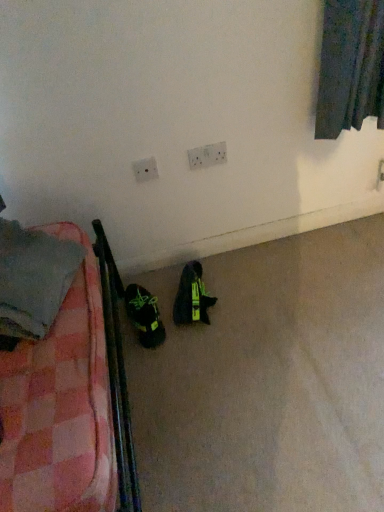
What is the approximate width of white plastic electric outlet at upper center, the 1th electric outlet in the left-to-right sequence?

white plastic electric outlet at upper center, the 1th electric outlet in the left-to-right sequence, is 1.00 centimeters wide.

What do you see at coordinates (207, 156) in the screenshot?
I see `white plastic electric outlet at upper center, the 2th electric outlet in the left-to-right sequence` at bounding box center [207, 156].

How much space does green matte sneakers at lower left, positioned as the first footwear in left-to-right order, occupy horizontally?

The width of green matte sneakers at lower left, positioned as the first footwear in left-to-right order, is 9.96 inches.

Describe the element at coordinates (33, 278) in the screenshot. I see `plaid fabric blanket at left` at that location.

I want to click on green synthetic shoe at center, which ranks as the first footwear in right-to-left order, so click(192, 297).

Can we say white plastic electric outlet at upper center, which is the second electric outlet in right-to-left order, lies outside plaid fabric blanket at left?

white plastic electric outlet at upper center, which is the second electric outlet in right-to-left order, lies outside plaid fabric blanket at left's area.

Which is behind, white plastic electric outlet at upper center, which is the second electric outlet in right-to-left order, or plaid fabric blanket at left?

white plastic electric outlet at upper center, which is the second electric outlet in right-to-left order.

Based on their sizes in the image, would you say white plastic electric outlet at upper center, which is the second electric outlet in right-to-left order, is bigger or smaller than plaid fabric blanket at left?

Considering their sizes, white plastic electric outlet at upper center, which is the second electric outlet in right-to-left order, takes up less space than plaid fabric blanket at left.

Does white plastic electric outlet at upper center, the 1th electric outlet in the left-to-right sequence, have a greater width compared to plaid fabric blanket at left?

No.

Can you confirm if plaid fabric blanket at left is positioned to the left of green matte sneakers at lower left, positioned as the first footwear in left-to-right order?

Yes, plaid fabric blanket at left is to the left of green matte sneakers at lower left, positioned as the first footwear in left-to-right order.

From the image's perspective, is plaid fabric blanket at left above or below green matte sneakers at lower left, arranged as the 2th footwear when viewed from the right?

plaid fabric blanket at left is above green matte sneakers at lower left, arranged as the 2th footwear when viewed from the right.

In the image, is plaid fabric blanket at left positioned in front of or behind green matte sneakers at lower left, arranged as the 2th footwear when viewed from the right?

Clearly, plaid fabric blanket at left is in front of green matte sneakers at lower left, arranged as the 2th footwear when viewed from the right.

Is plaid fabric blanket at left oriented away from green matte sneakers at lower left, arranged as the 2th footwear when viewed from the right?

plaid fabric blanket at left does not have its back to green matte sneakers at lower left, arranged as the 2th footwear when viewed from the right.

At what (x,y) coordinates should I click in order to perform the action: click on footwear below the green synthetic shoe at center, which appears as the second footwear when viewed from the left (from the image's perspective). Please return your answer as a coordinate pair (x, y). This screenshot has height=512, width=384. Looking at the image, I should click on (144, 316).

Which object is closer to the camera taking this photo, green matte sneakers at lower left, arranged as the 2th footwear when viewed from the right, or green synthetic shoe at center, which appears as the second footwear when viewed from the left?

green matte sneakers at lower left, arranged as the 2th footwear when viewed from the right.

Between green matte sneakers at lower left, arranged as the 2th footwear when viewed from the right, and green synthetic shoe at center, which appears as the second footwear when viewed from the left, which one has more height?

green matte sneakers at lower left, arranged as the 2th footwear when viewed from the right.

In terms of width, does plaid fabric blanket at left look wider or thinner when compared to white plastic electric outlet at upper center, the 2th electric outlet in the left-to-right sequence?

plaid fabric blanket at left is wider than white plastic electric outlet at upper center, the 2th electric outlet in the left-to-right sequence.

Is white plastic electric outlet at upper center, the first electric outlet from the right, inside plaid fabric blanket at left?

No, white plastic electric outlet at upper center, the first electric outlet from the right, is not inside plaid fabric blanket at left.

Measure the distance from plaid fabric blanket at left to white plastic electric outlet at upper center, the 2th electric outlet in the left-to-right sequence.

plaid fabric blanket at left is 69.74 centimeters from white plastic electric outlet at upper center, the 2th electric outlet in the left-to-right sequence.

Find the location of a particular element. the 2nd electric outlet counting from the right side of the plaid fabric blanket at left is located at coordinates (207, 156).

Is white plastic electric outlet at upper center, the first electric outlet from the right, turned away from plaid fabric blanket at left?

white plastic electric outlet at upper center, the first electric outlet from the right, is not turned away from plaid fabric blanket at left.

Visually, is white plastic electric outlet at upper center, the first electric outlet from the right, positioned to the left or to the right of plaid fabric blanket at left?

white plastic electric outlet at upper center, the first electric outlet from the right, is positioned on plaid fabric blanket at left's right side.

From the image's perspective, is white plastic electric outlet at upper center, the first electric outlet from the right, above or below plaid fabric blanket at left?

white plastic electric outlet at upper center, the first electric outlet from the right, is situated higher than plaid fabric blanket at left in the image.

What's the angular difference between white plastic electric outlet at upper center, the first electric outlet from the right, and plaid fabric blanket at left's facing directions?

The angular difference between white plastic electric outlet at upper center, the first electric outlet from the right, and plaid fabric blanket at left is 66.2 degrees.

This screenshot has width=384, height=512. Find the location of `electric outlet that is the 1st one when counting rightward from the green matte sneakers at lower left, arranged as the 2th footwear when viewed from the right`. electric outlet that is the 1st one when counting rightward from the green matte sneakers at lower left, arranged as the 2th footwear when viewed from the right is located at coordinates (145, 170).

Is green matte sneakers at lower left, arranged as the 2th footwear when viewed from the right, oriented away from white plastic electric outlet at upper center, which is the second electric outlet in right-to-left order?

No, white plastic electric outlet at upper center, which is the second electric outlet in right-to-left order, is not at the back of green matte sneakers at lower left, arranged as the 2th footwear when viewed from the right.

From the image's perspective, which object appears higher, green matte sneakers at lower left, positioned as the first footwear in left-to-right order, or white plastic electric outlet at upper center, which is the second electric outlet in right-to-left order?

From the image's view, white plastic electric outlet at upper center, which is the second electric outlet in right-to-left order, is above.

Which is behind, point (152, 339) or point (139, 176)?

Point (152, 339)

Is green matte sneakers at lower left, positioned as the first footwear in left-to-right order, taller or shorter than plaid fabric blanket at left?

Clearly, green matte sneakers at lower left, positioned as the first footwear in left-to-right order, is shorter compared to plaid fabric blanket at left.

Which point is more distant from viewer, [149,322] or [73,252]?

Positioned behind is point [149,322].

Is green matte sneakers at lower left, positioned as the first footwear in left-to-right order, at the left side of plaid fabric blanket at left?

Incorrect, green matte sneakers at lower left, positioned as the first footwear in left-to-right order, is not on the left side of plaid fabric blanket at left.

Does green matte sneakers at lower left, arranged as the 2th footwear when viewed from the right, touch plaid fabric blanket at left?

No, green matte sneakers at lower left, arranged as the 2th footwear when viewed from the right, is not in contact with plaid fabric blanket at left.

This screenshot has height=512, width=384. Find the location of `clothing on the left of the white plastic electric outlet at upper center, which is the second electric outlet in right-to-left order`. clothing on the left of the white plastic electric outlet at upper center, which is the second electric outlet in right-to-left order is located at coordinates (33, 278).

Locate an element on the screen. Image resolution: width=384 pixels, height=512 pixels. the 1st footwear counting from the right of the plaid fabric blanket at left is located at coordinates (144, 316).

Consider the image. From the image, which object appears to be nearer to green synthetic shoe at center, which ranks as the first footwear in right-to-left order, plaid fabric blanket at left or white plastic electric outlet at upper center, the 1th electric outlet in the left-to-right sequence?

white plastic electric outlet at upper center, the 1th electric outlet in the left-to-right sequence.

Estimate the real-world distances between objects in this image. Which object is closer to white plastic electric outlet at upper center, the 1th electric outlet in the left-to-right sequence, plaid fabric blanket at left or green matte sneakers at lower left, arranged as the 2th footwear when viewed from the right?

green matte sneakers at lower left, arranged as the 2th footwear when viewed from the right, lies closer to white plastic electric outlet at upper center, the 1th electric outlet in the left-to-right sequence, than the other object.

Looking at the image, which one is located further to white plastic electric outlet at upper center, which is the second electric outlet in right-to-left order, white plastic electric outlet at upper center, the first electric outlet from the right, or plaid fabric blanket at left?

plaid fabric blanket at left lies further to white plastic electric outlet at upper center, which is the second electric outlet in right-to-left order, than the other object.

Estimate the real-world distances between objects in this image. Which object is closer to green synthetic shoe at center, which ranks as the first footwear in right-to-left order, white plastic electric outlet at upper center, the 2th electric outlet in the left-to-right sequence, or white plastic electric outlet at upper center, the 1th electric outlet in the left-to-right sequence?

white plastic electric outlet at upper center, the 1th electric outlet in the left-to-right sequence.

In the scene shown: From the image, which object appears to be nearer to green matte sneakers at lower left, arranged as the 2th footwear when viewed from the right, green synthetic shoe at center, which appears as the second footwear when viewed from the left, or white plastic electric outlet at upper center, which is the second electric outlet in right-to-left order?

Among the two, green synthetic shoe at center, which appears as the second footwear when viewed from the left, is located nearer to green matte sneakers at lower left, arranged as the 2th footwear when viewed from the right.

Estimate the real-world distances between objects in this image. Which object is closer to green synthetic shoe at center, which ranks as the first footwear in right-to-left order, white plastic electric outlet at upper center, the 2th electric outlet in the left-to-right sequence, or green matte sneakers at lower left, positioned as the first footwear in left-to-right order?

green matte sneakers at lower left, positioned as the first footwear in left-to-right order, is closer to green synthetic shoe at center, which ranks as the first footwear in right-to-left order.

From the image, which object appears to be nearer to plaid fabric blanket at left, white plastic electric outlet at upper center, the 2th electric outlet in the left-to-right sequence, or white plastic electric outlet at upper center, the 1th electric outlet in the left-to-right sequence?

white plastic electric outlet at upper center, the 1th electric outlet in the left-to-right sequence, lies closer to plaid fabric blanket at left than the other object.

From the image, which object appears to be farther from green synthetic shoe at center, which appears as the second footwear when viewed from the left, white plastic electric outlet at upper center, the 1th electric outlet in the left-to-right sequence, or white plastic electric outlet at upper center, the 2th electric outlet in the left-to-right sequence?

white plastic electric outlet at upper center, the 2th electric outlet in the left-to-right sequence.

This screenshot has width=384, height=512. I want to click on footwear located between plaid fabric blanket at left and green synthetic shoe at center, which appears as the second footwear when viewed from the left, in the depth direction, so click(144, 316).

Where is `footwear between white plastic electric outlet at upper center, which is the second electric outlet in right-to-left order, and green matte sneakers at lower left, arranged as the 2th footwear when viewed from the right, from top to bottom`? This screenshot has width=384, height=512. footwear between white plastic electric outlet at upper center, which is the second electric outlet in right-to-left order, and green matte sneakers at lower left, arranged as the 2th footwear when viewed from the right, from top to bottom is located at coordinates (192, 297).

Identify the location of electric outlet between white plastic electric outlet at upper center, the first electric outlet from the right, and green synthetic shoe at center, which appears as the second footwear when viewed from the left, in the up-down direction. The image size is (384, 512). (145, 170).

You are a GUI agent. You are given a task and a screenshot of the screen. Output one action in this format:
    pyautogui.click(x=<x>, y=<y>)
    Task: Click on the footwear between white plastic electric outlet at upper center, the 2th electric outlet in the left-to-right sequence, and green matte sneakers at lower left, arranged as the 2th footwear when viewed from the right, from top to bottom
    This screenshot has height=512, width=384.
    Given the screenshot: What is the action you would take?
    pyautogui.click(x=192, y=297)